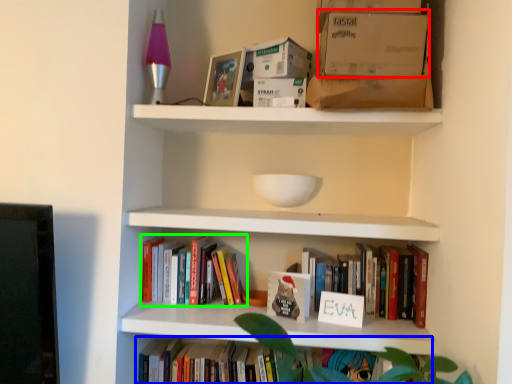
Question: Based on their relative distances, which object is farther from cardboard box (highlighted by a red box)? Choose from book (highlighted by a blue box) and book (highlighted by a green box).

Choices:
 (A) book
 (B) book

Answer: (A)